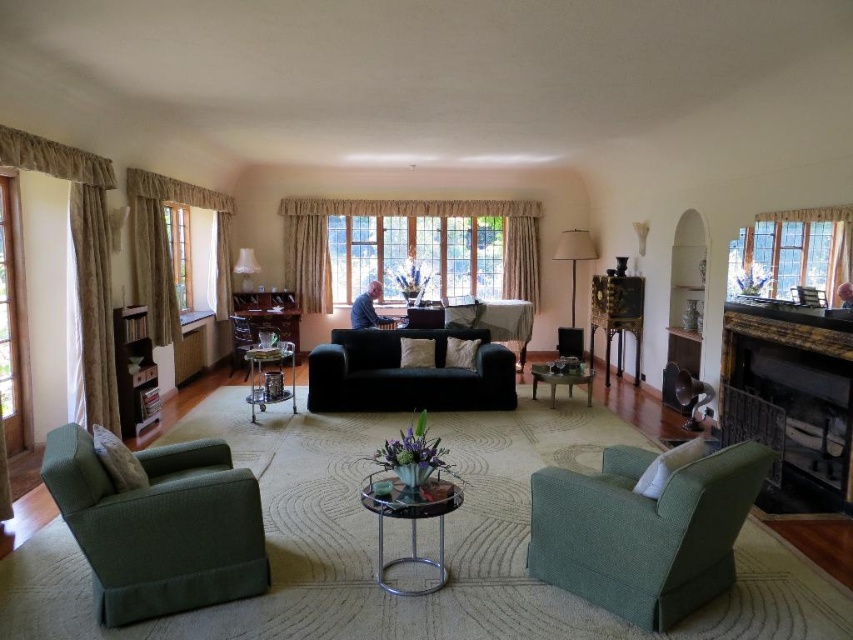
Question: Which point appears closest to the camera in this image?

Choices:
 (A) (428, 282)
 (B) (347, 397)

Answer: (B)

Question: Does black fabric couch at center have a greater width compared to matte white lampshade at upper center?

Choices:
 (A) yes
 (B) no

Answer: (A)

Question: Which object appears farthest from the camera in this image?

Choices:
 (A) clear glass window at center
 (B) dark brown wood fireplace at right

Answer: (A)

Question: From the image, what is the correct spatial relationship of green fabric armchair at lower left in relation to clear glass coffee table at center?

Choices:
 (A) left
 (B) right

Answer: (A)

Question: Which point is farther to the camera?

Choices:
 (A) (572, 365)
 (B) (593, 244)
 (C) (175, 224)

Answer: (B)

Question: In this image, where is green fabric armchair at lower right located relative to black fabric couch at center?

Choices:
 (A) right
 (B) left

Answer: (A)